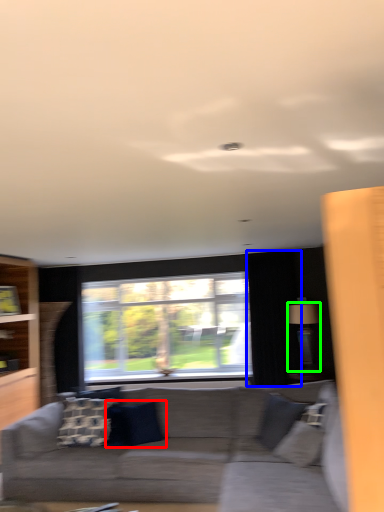
Question: Considering the real-world distances, which object is closest to pillow (highlighted by a red box)? curtain (highlighted by a blue box) or lamp (highlighted by a green box).

Choices:
 (A) curtain
 (B) lamp

Answer: (A)